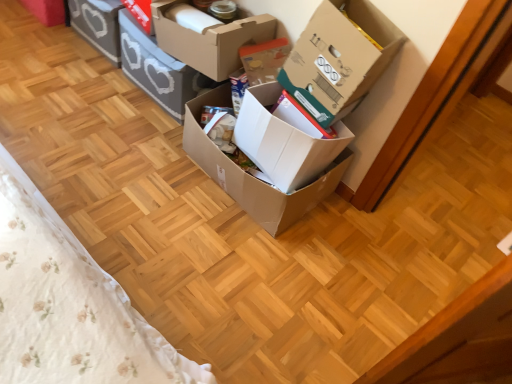
This screenshot has width=512, height=384. Describe the element at coordinates (207, 37) in the screenshot. I see `cardboard box at center, which is the fourth box from right to left` at that location.

Image resolution: width=512 pixels, height=384 pixels. What are the coordinates of `matte gray storage box at upper left, the first box positioned from the left` in the screenshot? It's located at (98, 25).

This screenshot has width=512, height=384. What do you see at coordinates (283, 141) in the screenshot? I see `cardboard box at center, arranged as the 5th box when viewed from the left` at bounding box center [283, 141].

The image size is (512, 384). What do you see at coordinates (272, 161) in the screenshot?
I see `brown cardboard box at center, marked as the 4th box in a left-to-right arrangement` at bounding box center [272, 161].

Describe the element at coordinates (339, 58) in the screenshot. I see `cardboard box at upper right, which ranks as the 1th box in right-to-left order` at that location.

The height and width of the screenshot is (384, 512). Identify the location of cardboard box at center, the 5th box positioned from the right. (158, 69).

Locate an element on the screen. cardboard box at center, which ranks as the third box in left-to-right order is located at coordinates (207, 37).

In the image, is cardboard box at center, which ranks as the third box in left-to-right order, positioned in front of or behind cardboard box at upper right, the 6th box viewed from the left?

cardboard box at center, which ranks as the third box in left-to-right order, is positioned farther from the viewer than cardboard box at upper right, the 6th box viewed from the left.

Who is bigger, cardboard box at center, which is the fourth box from right to left, or cardboard box at upper right, which ranks as the 1th box in right-to-left order?

cardboard box at upper right, which ranks as the 1th box in right-to-left order, is bigger.

Considering the relative positions of cardboard box at center, which ranks as the third box in left-to-right order, and cardboard box at upper right, the 6th box viewed from the left, in the image provided, is cardboard box at center, which ranks as the third box in left-to-right order, to the right of cardboard box at upper right, the 6th box viewed from the left, from the viewer's perspective?

Incorrect, cardboard box at center, which ranks as the third box in left-to-right order, is not on the right side of cardboard box at upper right, the 6th box viewed from the left.

Can you confirm if cardboard box at center, the second box in the left-to-right sequence, is wider than cardboard box at center, which ranks as the third box in left-to-right order?

No.

From a real-world perspective, is cardboard box at center, the second box in the left-to-right sequence, physically below cardboard box at center, which ranks as the third box in left-to-right order?

Indeed, from a real-world perspective, cardboard box at center, the second box in the left-to-right sequence, is positioned beneath cardboard box at center, which ranks as the third box in left-to-right order.

There is a cardboard box at center, which is the fourth box from right to left. What are the coordinates of `the 3rd box below it (from a real-world perspective)` in the screenshot? It's located at (158, 69).

Considering the points (128, 65) and (216, 69), which point is in front, point (128, 65) or point (216, 69)?

Positioned in front is point (216, 69).

Considering the relative positions of cardboard box at center, the second box in the left-to-right sequence, and cardboard box at center, arranged as the 5th box when viewed from the left, in the image provided, is cardboard box at center, the second box in the left-to-right sequence, to the right of cardboard box at center, arranged as the 5th box when viewed from the left, from the viewer's perspective?

Result: No, cardboard box at center, the second box in the left-to-right sequence, is not to the right of cardboard box at center, arranged as the 5th box when viewed from the left.

Is point (165, 74) closer to camera compared to point (246, 122)?

No, (165, 74) is behind (246, 122).

Between cardboard box at center, the second box in the left-to-right sequence, and cardboard box at center, placed as the second box when sorted from right to left, which one has smaller size?

cardboard box at center, placed as the second box when sorted from right to left.

How many degrees apart are the facing directions of cardboard box at center, the 5th box positioned from the right, and cardboard box at center, placed as the second box when sorted from right to left?

cardboard box at center, the 5th box positioned from the right, and cardboard box at center, placed as the second box when sorted from right to left, are facing 6.05 degrees away from each other.

The image size is (512, 384). Identify the location of the 2nd box behind the cardboard box at center, which is the fourth box from right to left. (98, 25).

From the image's perspective, is cardboard box at center, which is the fourth box from right to left, beneath matte gray storage box at upper left, which is the sixth box from right to left?

Correct, cardboard box at center, which is the fourth box from right to left, appears lower than matte gray storage box at upper left, which is the sixth box from right to left, in the image.

From a real-world perspective, who is located higher, cardboard box at center, which ranks as the third box in left-to-right order, or matte gray storage box at upper left, which is the sixth box from right to left?

cardboard box at center, which ranks as the third box in left-to-right order, is physically above.

From a real-world perspective, which object stands above the other?

From a 3D spatial view, cardboard box at center, which is the fourth box from right to left, is above.

Between brown cardboard box at center, marked as the 4th box in a left-to-right arrangement, and cardboard box at center, which is the fourth box from right to left, which one appears on the left side from the viewer's perspective?

cardboard box at center, which is the fourth box from right to left.

Is point (297, 191) positioned behind point (153, 11)?

No, (297, 191) is closer to viewer.

Between brown cardboard box at center, the third box positioned from the right, and cardboard box at center, which ranks as the third box in left-to-right order, which one has smaller width?

A: Thinner between the two is cardboard box at center, which ranks as the third box in left-to-right order.

Which object is wider, cardboard box at center, arranged as the 5th box when viewed from the left, or cardboard box at center, which ranks as the third box in left-to-right order?

cardboard box at center, arranged as the 5th box when viewed from the left.

From the image's perspective, is cardboard box at center, placed as the second box when sorted from right to left, located above or below cardboard box at center, which ranks as the third box in left-to-right order?

cardboard box at center, placed as the second box when sorted from right to left, is situated lower than cardboard box at center, which ranks as the third box in left-to-right order, in the image.

Consider the image. Do you think cardboard box at center, placed as the second box when sorted from right to left, is within cardboard box at center, which is the fourth box from right to left, or outside of it?

cardboard box at center, placed as the second box when sorted from right to left, is spatially situated outside cardboard box at center, which is the fourth box from right to left.

Consider the image. Is cardboard box at center, placed as the second box when sorted from right to left, bigger or smaller than cardboard box at center, which is the fourth box from right to left?

In the image, cardboard box at center, placed as the second box when sorted from right to left, appears to be smaller than cardboard box at center, which is the fourth box from right to left.

From the image's perspective, is cardboard box at center, placed as the second box when sorted from right to left, beneath matte gray storage box at upper left, which is the sixth box from right to left?

Yes, from the image's perspective, cardboard box at center, placed as the second box when sorted from right to left, is beneath matte gray storage box at upper left, which is the sixth box from right to left.

In the image, is cardboard box at center, arranged as the 5th box when viewed from the left, on the left side or the right side of matte gray storage box at upper left, which is the sixth box from right to left?

cardboard box at center, arranged as the 5th box when viewed from the left, is to the right of matte gray storage box at upper left, which is the sixth box from right to left.

How different are the orientations of cardboard box at center, arranged as the 5th box when viewed from the left, and matte gray storage box at upper left, which is the sixth box from right to left, in degrees?

6.05 degrees separate the facing orientations of cardboard box at center, arranged as the 5th box when viewed from the left, and matte gray storage box at upper left, which is the sixth box from right to left.

Is point (244, 131) closer to viewer compared to point (108, 40)?

Yes, it is in front of point (108, 40).

Which box is the 3rd one when counting from the right side of the cardboard box at center, which is the fourth box from right to left? Please provide its 2D coordinates.

[(339, 58)]

The image size is (512, 384). In order to click on the 1st box behind the cardboard box at center, which is the fourth box from right to left in this screenshot , I will do `click(158, 69)`.

Which object lies nearer to the anchor point cardboard box at center, placed as the second box when sorted from right to left, cardboard box at center, the 5th box positioned from the right, or cardboard box at upper right, which ranks as the 1th box in right-to-left order?

Among the two, cardboard box at upper right, which ranks as the 1th box in right-to-left order, is located nearer to cardboard box at center, placed as the second box when sorted from right to left.

From the image, which object appears to be nearer to cardboard box at upper right, which ranks as the 1th box in right-to-left order, cardboard box at center, the second box in the left-to-right sequence, or cardboard box at center, placed as the second box when sorted from right to left?

cardboard box at center, placed as the second box when sorted from right to left, lies closer to cardboard box at upper right, which ranks as the 1th box in right-to-left order, than the other object.

Looking at the image, which one is located further to matte gray storage box at upper left, which is the sixth box from right to left, cardboard box at center, the 5th box positioned from the right, or cardboard box at center, placed as the second box when sorted from right to left?

The object further to matte gray storage box at upper left, which is the sixth box from right to left, is cardboard box at center, placed as the second box when sorted from right to left.

Consider the image. Considering their positions, is cardboard box at upper right, the 6th box viewed from the left, positioned closer to cardboard box at center, arranged as the 5th box when viewed from the left, than cardboard box at center, the second box in the left-to-right sequence?

cardboard box at upper right, the 6th box viewed from the left.

Based on their spatial positions, is cardboard box at center, placed as the second box when sorted from right to left, or cardboard box at center, which is the fourth box from right to left, closer to cardboard box at upper right, the 6th box viewed from the left?

cardboard box at center, placed as the second box when sorted from right to left, is positioned closer to the anchor cardboard box at upper right, the 6th box viewed from the left.

Which object lies nearer to the anchor point cardboard box at center, the 5th box positioned from the right, brown cardboard box at center, marked as the 4th box in a left-to-right arrangement, or cardboard box at upper right, which ranks as the 1th box in right-to-left order?

brown cardboard box at center, marked as the 4th box in a left-to-right arrangement, is closer to cardboard box at center, the 5th box positioned from the right.

Considering their positions, is cardboard box at center, arranged as the 5th box when viewed from the left, positioned further to brown cardboard box at center, marked as the 4th box in a left-to-right arrangement, than cardboard box at center, the second box in the left-to-right sequence?

Among the two, cardboard box at center, the second box in the left-to-right sequence, is located further to brown cardboard box at center, marked as the 4th box in a left-to-right arrangement.

Estimate the real-world distances between objects in this image. Which object is closer to cardboard box at center, placed as the second box when sorted from right to left, brown cardboard box at center, marked as the 4th box in a left-to-right arrangement, or cardboard box at center, which ranks as the third box in left-to-right order?

brown cardboard box at center, marked as the 4th box in a left-to-right arrangement, is closer to cardboard box at center, placed as the second box when sorted from right to left.

Find the location of a particular element. Image resolution: width=512 pixels, height=384 pixels. box between cardboard box at upper right, which ranks as the 1th box in right-to-left order, and brown cardboard box at center, the third box positioned from the right, from front to back is located at coordinates (283, 141).

Identify the location of box between matte gray storage box at upper left, the first box positioned from the left, and cardboard box at center, which ranks as the third box in left-to-right order, in the horizontal direction. The height and width of the screenshot is (384, 512). (158, 69).